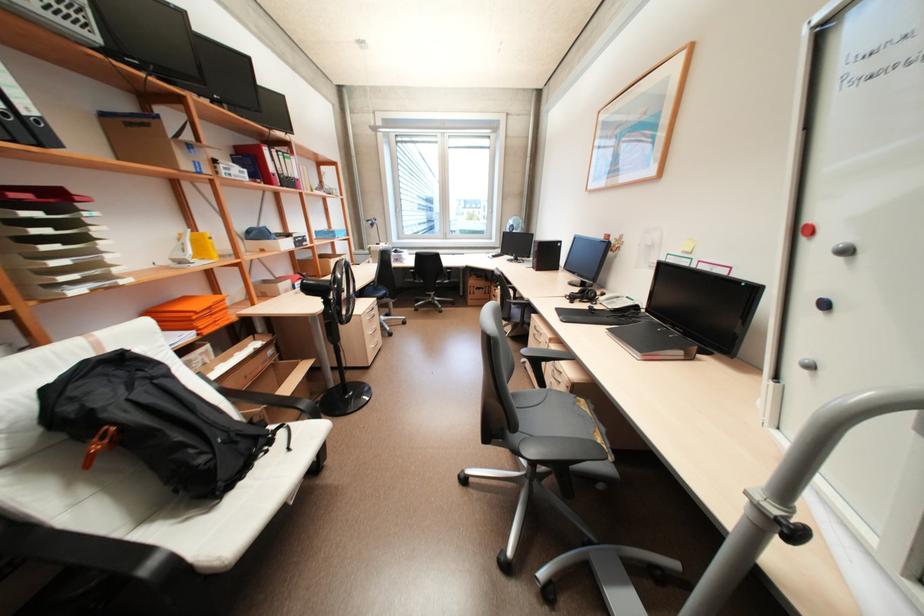
Locate an element on the screen. Image resolution: width=924 pixels, height=616 pixels. gray chair sitting surface is located at coordinates 543,398.